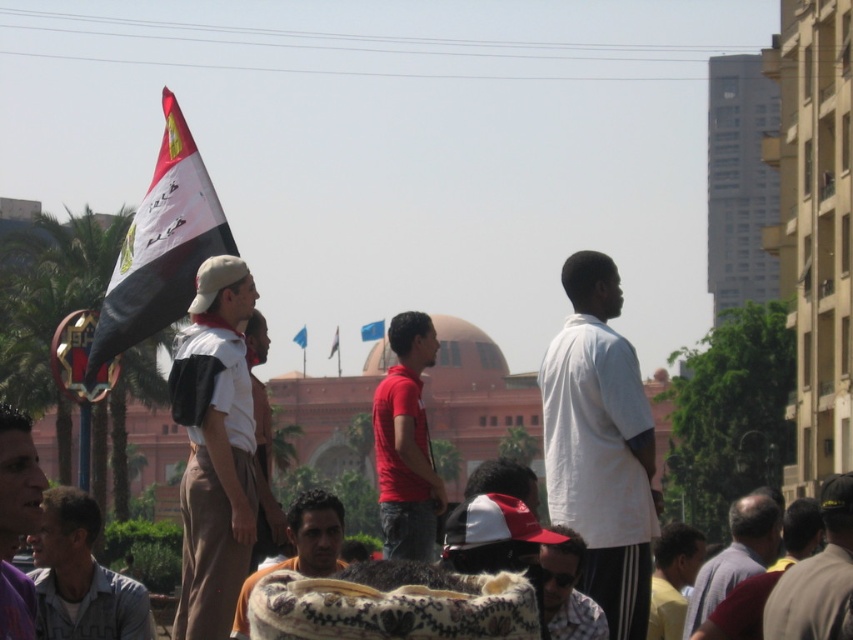
Does gray fabric shirt at lower right come behind blue fabric flag at upper center?

That is False.

Who is positioned more to the left, gray fabric shirt at lower right or blue fabric flag at upper center?

blue fabric flag at upper center

Between point (701, 589) and point (306, 333), which one is positioned behind?

Point (306, 333)

Where is `gray fabric shirt at lower right`? Image resolution: width=853 pixels, height=640 pixels. gray fabric shirt at lower right is located at coordinates (735, 556).

Is the position of yellow t-shirt at lower right more distant than that of blue fabric flag at center?

No, it is in front of blue fabric flag at center.

Is yellow t-shirt at lower right thinner than blue fabric flag at center?

No, yellow t-shirt at lower right is not thinner than blue fabric flag at center.

Between point (646, 636) and point (367, 324), which one is positioned in front?

Point (646, 636) is in front.

At what (x,y) coordinates should I click in order to perform the action: click on yellow t-shirt at lower right. Please return your answer as a coordinate pair (x, y). This screenshot has height=640, width=853. Looking at the image, I should click on (672, 579).

Who is positioned more to the left, light brown shirt at lower left or plaid shirt at center?

Positioned to the left is light brown shirt at lower left.

Can you confirm if light brown shirt at lower left is taller than plaid shirt at center?

Indeed, light brown shirt at lower left has a greater height compared to plaid shirt at center.

Locate an element on the screen. The height and width of the screenshot is (640, 853). light brown shirt at lower left is located at coordinates (80, 577).